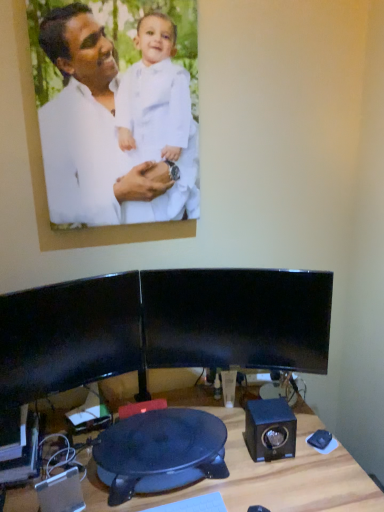
Question: Is black glossy monitor at center, the 1th computer monitor positioned from the right, wider or thinner than wooden desk at lower center?

Choices:
 (A) thin
 (B) wide

Answer: (A)

Question: Is black glossy monitor at center, the 1th computer monitor positioned from the right, inside the boundaries of wooden desk at lower center, or outside?

Choices:
 (A) inside
 (B) outside

Answer: (B)

Question: Based on their relative distances, which object is farther from the black plastic swivel chair at center?

Choices:
 (A) black glossy monitor at center, acting as the 2th computer monitor starting from the right
 (B) black plastic keyboard at lower center
 (C) wooden desk at lower center
 (D) black plastic speaker at lower left, marked as the 1th speaker in a front-to-back arrangement
 (E) white matte picture frame at upper left

Answer: (E)

Question: Which is nearer to the blue matte speaker at lower right, the first speaker viewed from the back?

Choices:
 (A) wooden desk at lower center
 (B) black plastic speaker at lower left, the 2th speaker when ordered from back to front
 (C) white matte picture frame at upper left
 (D) black glossy monitor at center, the 1th computer monitor positioned from the right
 (E) black plastic swivel chair at center

Answer: (A)